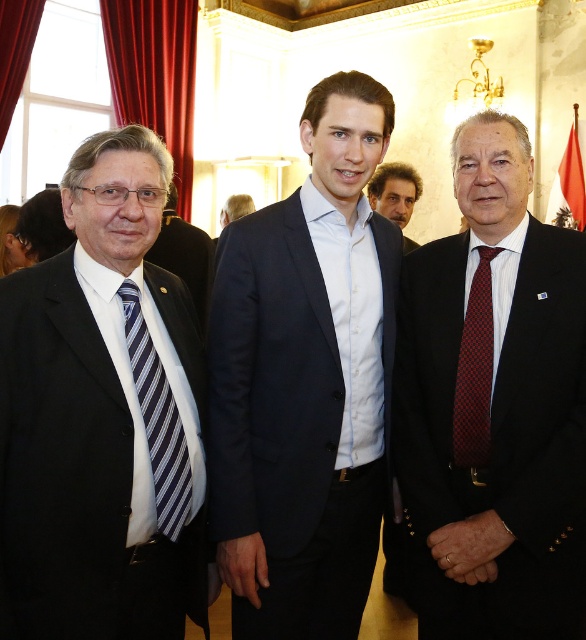
Is black silk suit at left to the right of navy blue suit at center from the viewer's perspective?

In fact, black silk suit at left is to the left of navy blue suit at center.

Is the position of black silk suit at left less distant than that of navy blue suit at center?

Yes, black silk suit at left is closer to the viewer.

Who is more forward, (144, 314) or (265, 225)?

Point (144, 314) is in front.

What are the coordinates of `black silk suit at left` in the screenshot? It's located at (101, 417).

Is navy blue suit at center taller than matte black suit at center?

Indeed, navy blue suit at center has a greater height compared to matte black suit at center.

Does navy blue suit at center appear over matte black suit at center?

No.

Is point (261, 451) closer to camera compared to point (226, 221)?

Yes, it is.

This screenshot has height=640, width=586. I want to click on navy blue suit at center, so click(x=305, y=380).

Does dark blue suit at center have a greater height compared to matte black suit at left?

Indeed, dark blue suit at center has a greater height compared to matte black suit at left.

Does point (499, 346) come in front of point (173, 225)?

That is True.

I want to click on dark blue suit at center, so click(x=493, y=404).

Locate an element on the screen. dark blue suit at center is located at coordinates (493, 404).